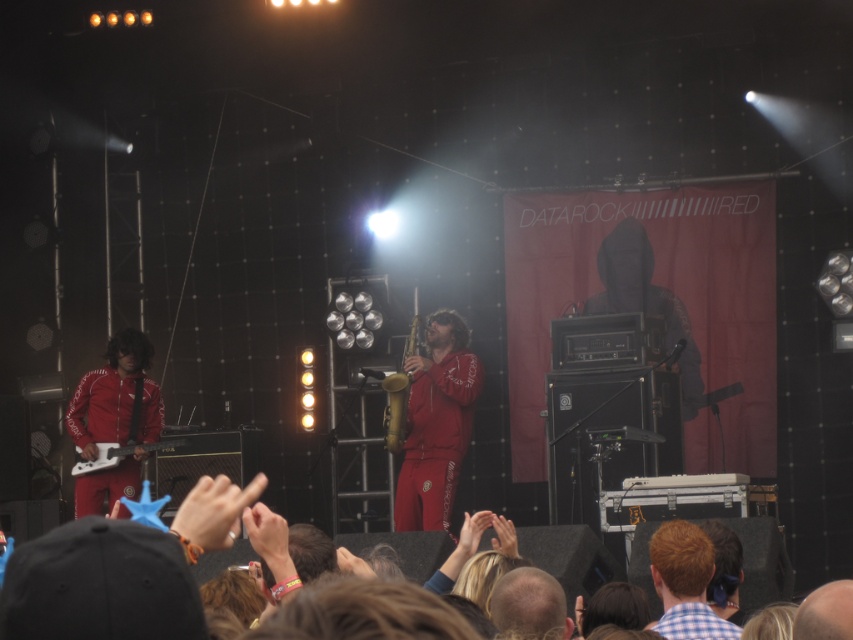
You are a photographer at the concert venue and want to capture a photo where both the matte red tracksuit at center and the checkered fabric shirt at lower center are visible. Based on their sizes in the image, which one might appear larger in the final photo?

The matte red tracksuit at center appears larger in the final photo because it is taller than the checkered fabric shirt at lower center.

You are a photographer at the concert venue and want to capture a photo of both the matte red tracksuit at center and the gold brass saxophone at center. Which object should you focus on first if you want to ensure both are in the frame?

The matte red tracksuit at center is taller than the gold brass saxophone at center, so you should focus on the taller object first to ensure proper framing.

You are a stagehand who needs to move a 40 cm wide equipment box between the matte red tracksuit at center and the gold brass saxophone at center. Can you fit the box between them without touching either?

The distance between the matte red tracksuit at center and the gold brass saxophone at center is 35.88 centimeters. Since the equipment box is 40 cm wide, it cannot fit between them without overlapping.